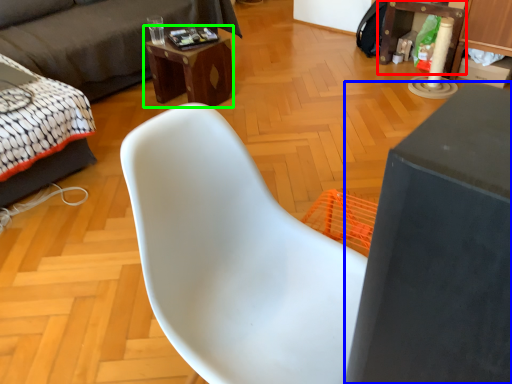
Question: Considering the real-world distances, which object is closest to table (highlighted by a red box)? table (highlighted by a blue box) or desk (highlighted by a green box).

Choices:
 (A) table
 (B) desk

Answer: (B)